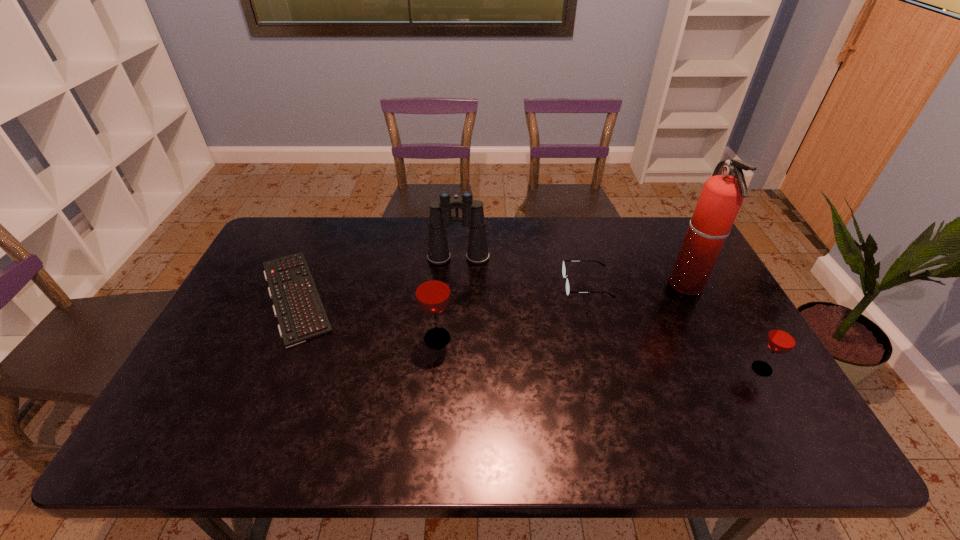
Where is `the taller glass`? the taller glass is located at coordinates (432, 289).

This screenshot has height=540, width=960. What are the coordinates of `the left glass` in the screenshot? It's located at (432, 289).

Where is `the third shortest object`? The image size is (960, 540). the third shortest object is located at coordinates (782, 338).

Image resolution: width=960 pixels, height=540 pixels. Identify the location of the nearest object. (782, 338).

What are the coordinates of `fire extinguisher` in the screenshot? It's located at (722, 195).

This screenshot has width=960, height=540. I want to click on the tallest object, so click(722, 195).

This screenshot has width=960, height=540. What are the coordinates of `the fifth tallest object` in the screenshot? It's located at (564, 267).

Where is `spectacles`? spectacles is located at coordinates (564, 267).

In order to click on computer keyboard in this screenshot , I will do point(297,305).

Find the location of a particular element. The image size is (960, 540). the shortest object is located at coordinates (297, 305).